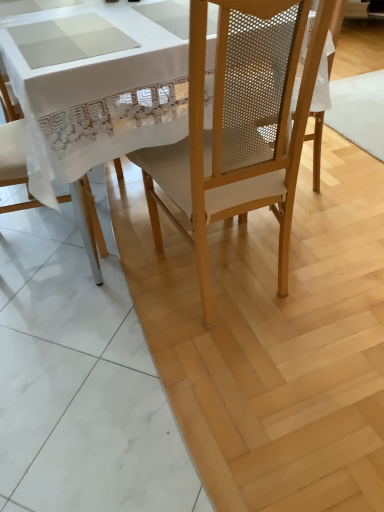
Where is `space that is in front of white fabric chair at left, which ranks as the first chair in left-to-right order`? space that is in front of white fabric chair at left, which ranks as the first chair in left-to-right order is located at coordinates (61, 302).